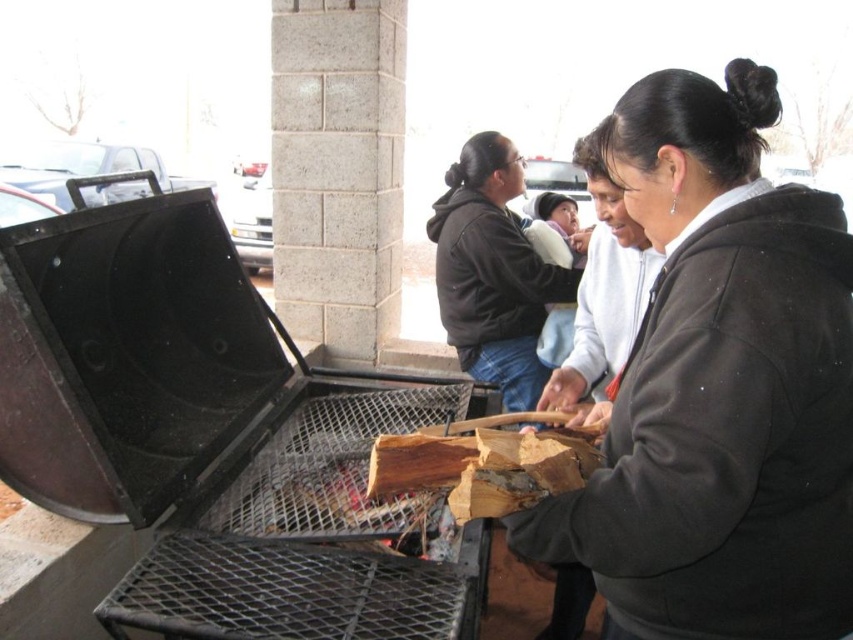
Question: Which object is closer to the camera taking this photo?

Choices:
 (A) dark brown hoodie at center
 (B) black matte grill at left
 (C) dark gray fleece jacket at center

Answer: (C)

Question: Is black matte grill at left thinner than dark brown hoodie at center?

Choices:
 (A) yes
 (B) no

Answer: (B)

Question: In this image, where is black matte grill at left located relative to dark brown hoodie at center?

Choices:
 (A) below
 (B) above

Answer: (A)

Question: Which point is closer to the camera taking this photo?

Choices:
 (A) (235, 280)
 (B) (529, 257)

Answer: (A)

Question: Estimate the real-world distances between objects in this image. Which object is closer to the black matte grill at left?

Choices:
 (A) dark brown hoodie at center
 (B) dark gray fleece jacket at center

Answer: (B)

Question: Is dark gray fleece jacket at center positioned behind black matte grill at left?

Choices:
 (A) yes
 (B) no

Answer: (B)